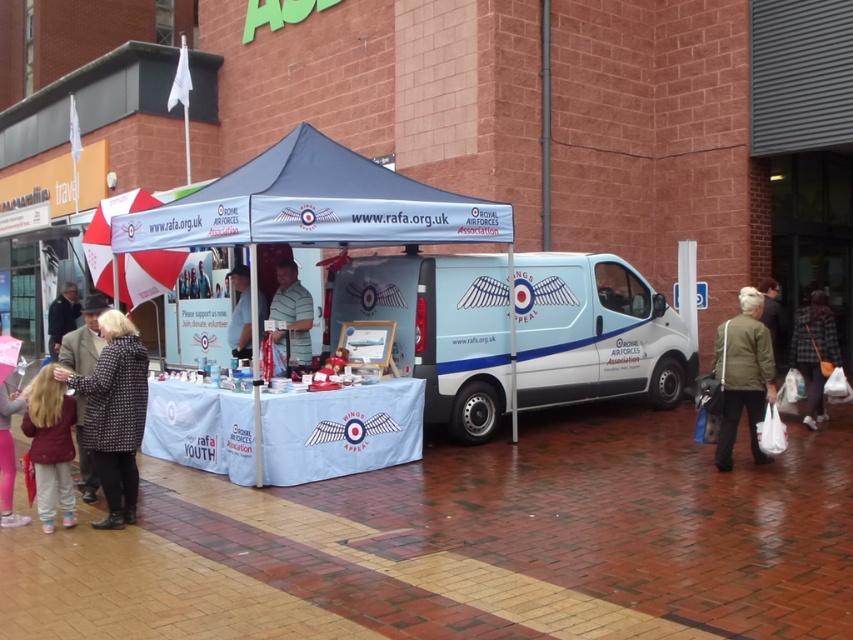
Based on the photo, you are a pedestrian walking along the wet brick street and notice the RAFA stall with its blue canopy. You see a white glossy van at center and light brown hair at lower left. Which object is positioned more to the east? Please answer based on the scene orientation where the stall faces north.

The white glossy van at center is to the right of light brown hair at lower left. Since the stall faces north, right would correspond to the east direction. Therefore, the white glossy van at center is positioned more to the east.

Consider the image. You are a customer at the RAFA stall who wants to pick up both the patterned coat at center and the green striped shirt at center. If your arms can extend 1.5 meters, can you reach both items at the same time?

The distance between the patterned coat at center and green striped shirt at center is 2.35 meters, which exceeds your arms reach of 1.5 meters. You cannot reach both items simultaneously.